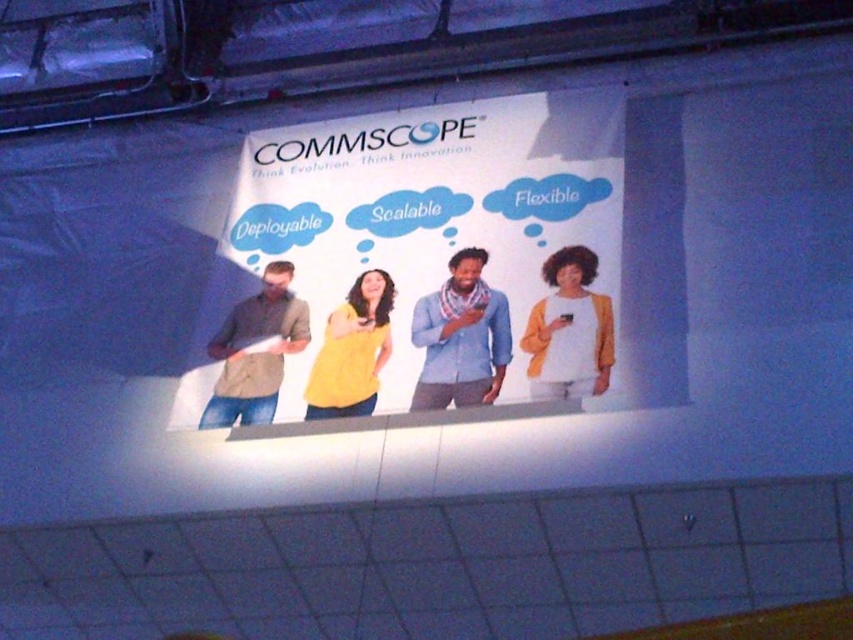
Question: Does white paper at center have a larger size compared to blue cotton shirt at center?

Choices:
 (A) yes
 (B) no

Answer: (A)

Question: Is white paper at center thinner than matte brown shirt at left?

Choices:
 (A) yes
 (B) no

Answer: (B)

Question: Does matte brown shirt at left have a greater width compared to yellow matte shirt at center?

Choices:
 (A) no
 (B) yes

Answer: (B)

Question: Based on their relative distances, which object is nearer to the white paper at center?

Choices:
 (A) matte brown shirt at left
 (B) white matte shirt at center
 (C) yellow matte shirt at center
 (D) blue cotton shirt at center

Answer: (D)

Question: Which object appears closest to the camera in this image?

Choices:
 (A) white paper at center
 (B) yellow matte shirt at center

Answer: (A)

Question: Which is nearer to the white paper at center?

Choices:
 (A) white matte shirt at center
 (B) blue cotton shirt at center
 (C) matte brown shirt at left
 (D) yellow matte shirt at center

Answer: (B)